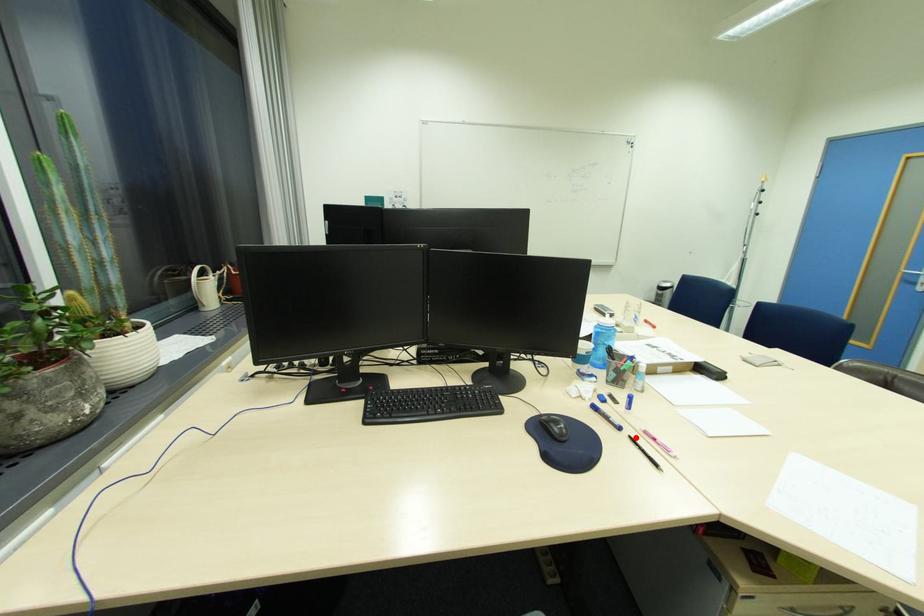
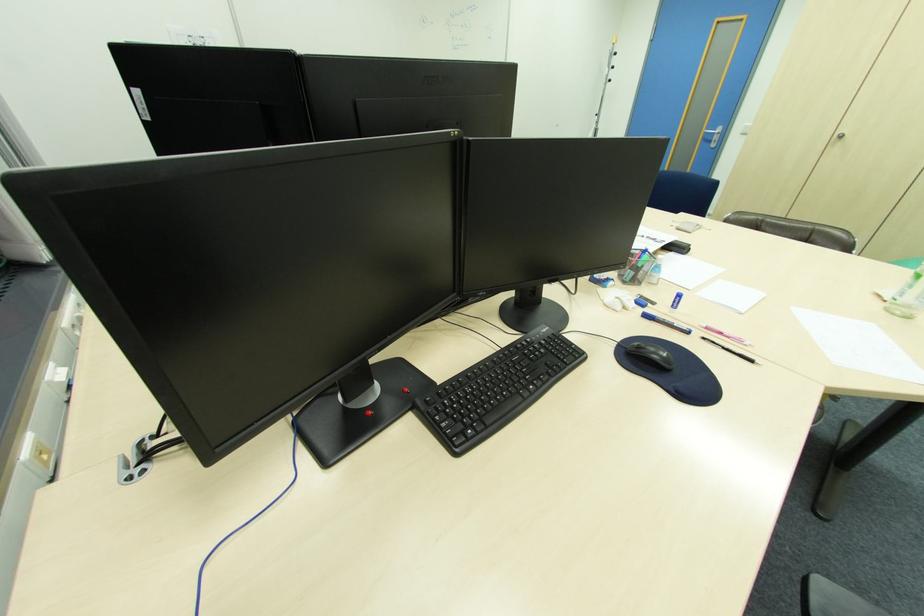
The point at the highlighted location is marked in the first image. Where is the corresponding point in the second image?

(709, 339)